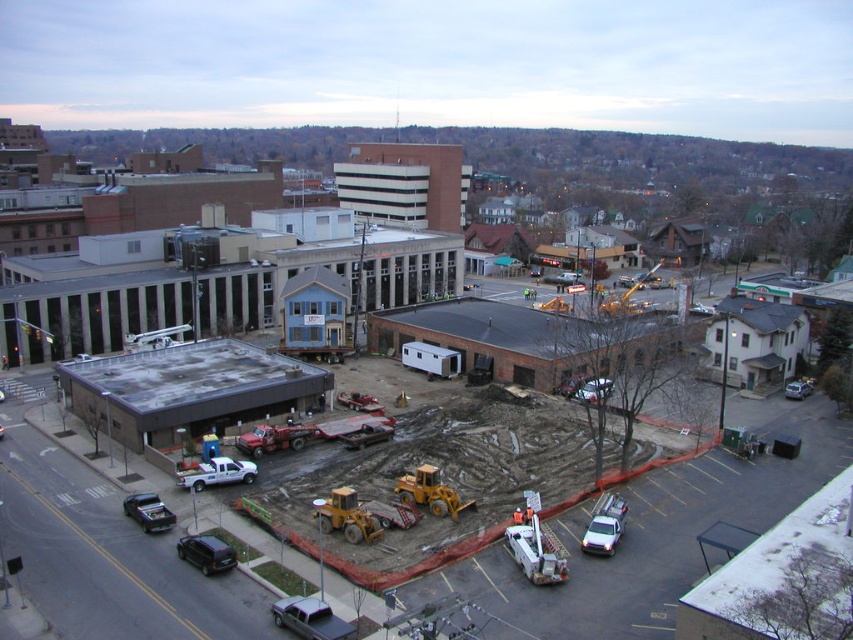
From the picture: You are a construction worker standing at the edge of the fenced area in the urban construction site. You need to reach both the point at coordinates point (209, 554) and point (796, 390). Which point will you reach first if you start moving towards them from your current position?

You will reach the point at coordinates point (209, 554) first because it is closer to you than point (796, 390).

You are a delivery driver who needs to park your vehicle in the construction site. You see a shiny black sedan at lower left and a metallic silver sedan at center. Which vehicle is parked closer to the ground level?

The shiny black sedan at lower left is located below metallic silver sedan at center, so it is closer to the ground level.

You are a delivery driver who needs to navigate a 70 meter long truck through the construction site. You see the shiny black sedan at lower left and the metallic silver sedan at center. Can you safely drive your truck between them without hitting either?

The distance between the shiny black sedan at lower left and the metallic silver sedan at center is 65.12 meters. Since your truck is 70 meters long, it would not fit between them. You need to find another route or wait for one of the sedans to move.